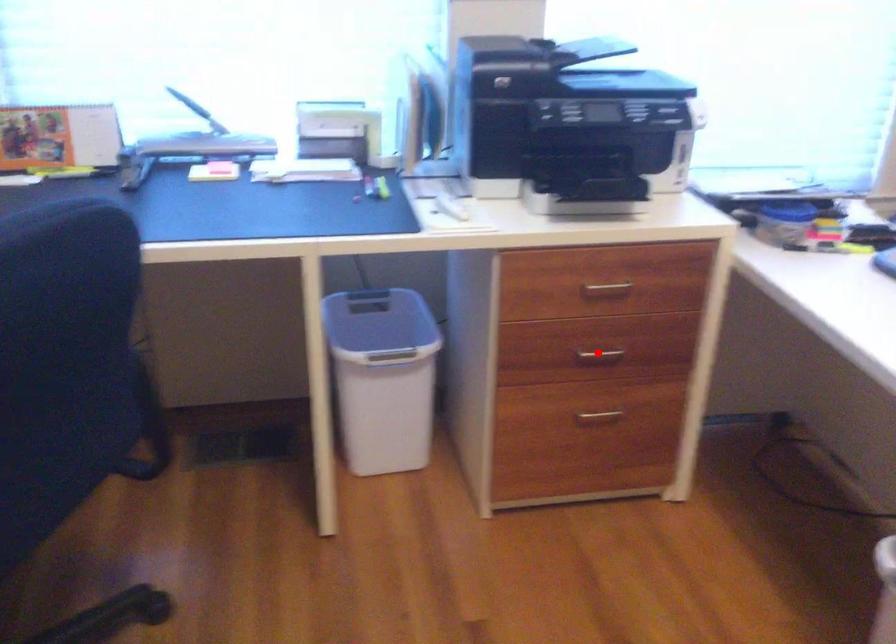
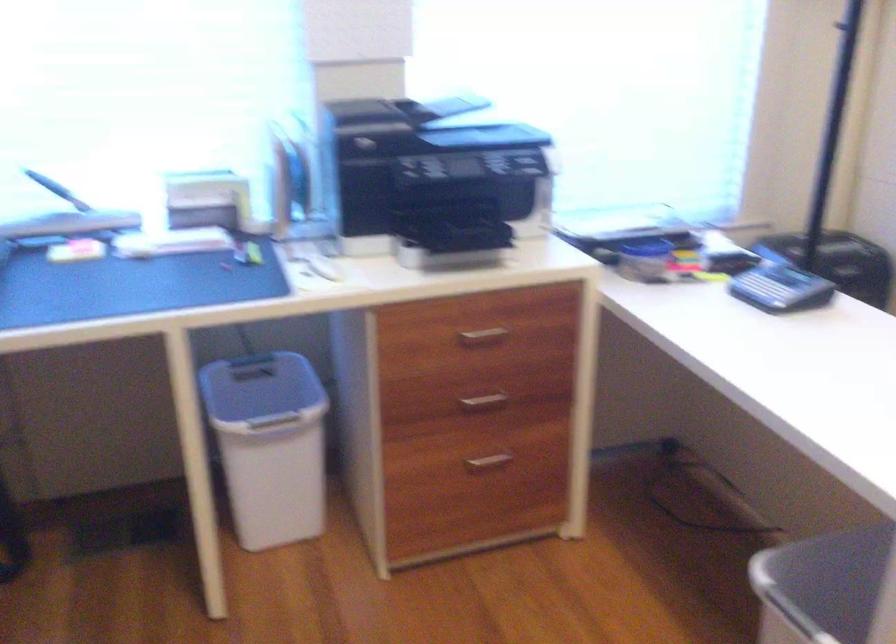
The point at the highlighted location is marked in the first image. Where is the corresponding point in the second image?

(484, 401)